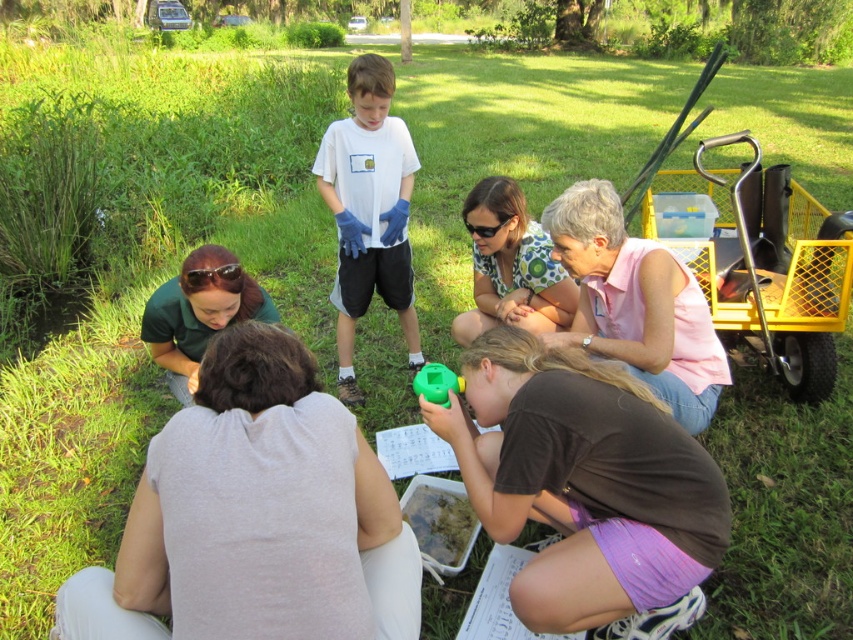
Is pink cotton shirt at upper center to the left of pink fabric at center from the viewer's perspective?

In fact, pink cotton shirt at upper center is to the right of pink fabric at center.

Which is in front, point (653, 339) or point (526, 324)?

Positioned in front is point (653, 339).

Who is more forward, (604, 180) or (532, 236)?

Positioned in front is point (604, 180).

Find the location of a particular element. The height and width of the screenshot is (640, 853). pink cotton shirt at upper center is located at coordinates (636, 304).

Does white fabric at lower center have a smaller size compared to green matte plastic bottle at lower center?

No, white fabric at lower center is not smaller than green matte plastic bottle at lower center.

Describe the element at coordinates (254, 515) in the screenshot. This screenshot has width=853, height=640. I see `white fabric at lower center` at that location.

Where is `white fabric at lower center`? white fabric at lower center is located at coordinates (254, 515).

Between point (543, 602) and point (633, 272), which one is positioned behind?

Positioned behind is point (633, 272).

Is green matte plastic bottle at lower center bigger than pink cotton shirt at upper center?

No.

What do you see at coordinates (582, 481) in the screenshot? I see `green matte plastic bottle at lower center` at bounding box center [582, 481].

The height and width of the screenshot is (640, 853). Find the location of `green matte plastic bottle at lower center`. green matte plastic bottle at lower center is located at coordinates (582, 481).